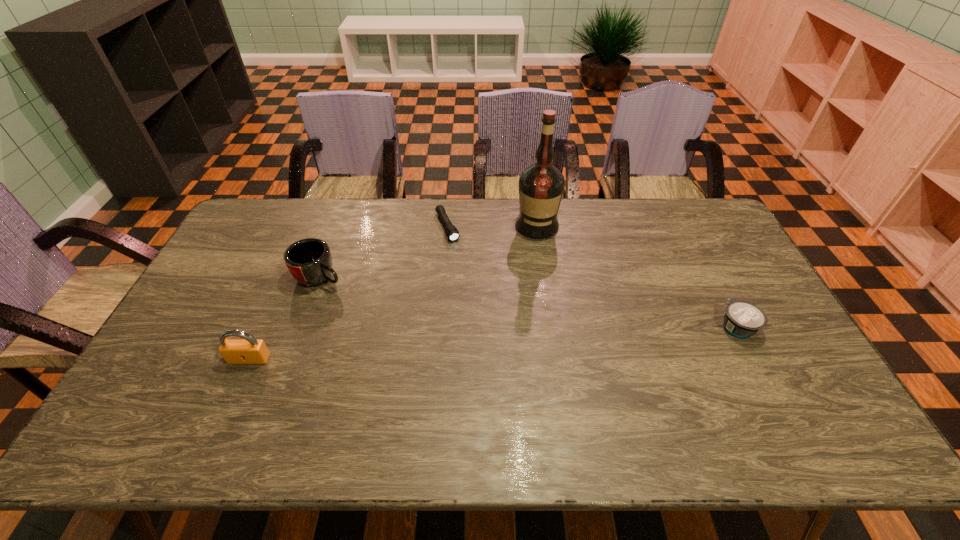
This screenshot has height=540, width=960. In order to click on padlock in this screenshot , I will do `click(249, 350)`.

Locate an element on the screen. This screenshot has width=960, height=540. the rightmost object is located at coordinates (742, 319).

This screenshot has width=960, height=540. Find the location of `yogurt`. yogurt is located at coordinates (742, 319).

The width and height of the screenshot is (960, 540). What are the coordinates of `the tallest object` in the screenshot? It's located at pos(541,185).

The width and height of the screenshot is (960, 540). Identify the location of the fourth object from left to right. (541, 185).

Find the location of a particular element. Image resolution: width=960 pixels, height=540 pixels. the shortest object is located at coordinates (451, 231).

Find the location of a particular element. The height and width of the screenshot is (540, 960). the third object from left to right is located at coordinates (451, 231).

In order to click on mug in this screenshot , I will do `click(309, 260)`.

Find the location of a particular element. free region located 0.120m to unlock the nearest object from the front is located at coordinates (228, 406).

Where is `vacant space located 0.150m on the left of the second nearest object`? This screenshot has height=540, width=960. vacant space located 0.150m on the left of the second nearest object is located at coordinates (665, 327).